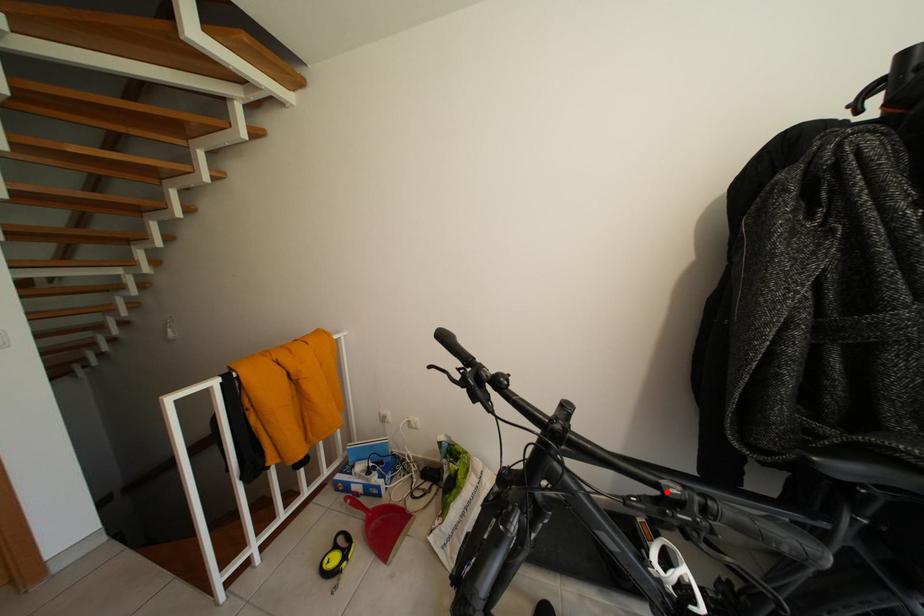
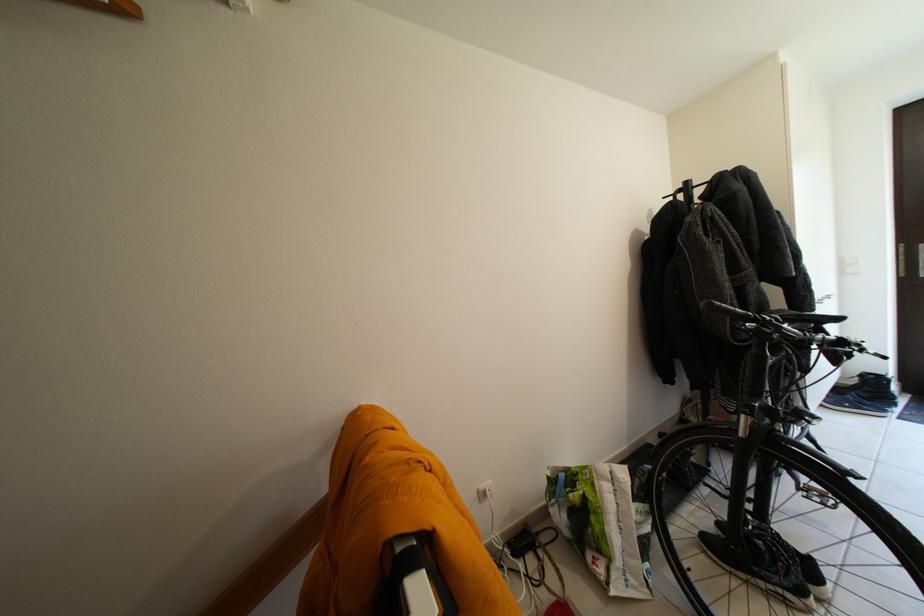
Question: I am providing you with two images of the same scene from different viewpoints. Image1 has a red point marked. In image2, the corresponding 3D location appears at what relative position? Reply with the corresponding letter.

Choices:
 (A) Closer
 (B) Farther

Answer: (A)